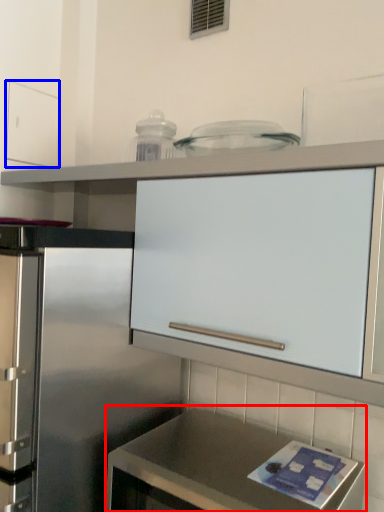
Question: Which object is further to the camera taking this photo, countertop (highlighted by a red box) or drawer (highlighted by a blue box)?

Choices:
 (A) countertop
 (B) drawer

Answer: (B)